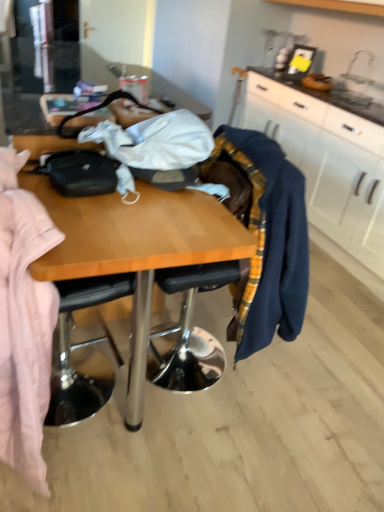
Question: In terms of size, does white matte cabinet at upper right appear bigger or smaller than navy blue sweater at right?

Choices:
 (A) big
 (B) small

Answer: (A)

Question: In the image, is white matte cabinet at upper right on the left side or the right side of navy blue sweater at right?

Choices:
 (A) right
 (B) left

Answer: (A)

Question: Which of these objects is positioned farthest from the white matte cabinet at upper right?

Choices:
 (A) metallic silver chair at center
 (B) navy blue sweater at right

Answer: (B)

Question: Estimate the real-world distances between objects in this image. Which object is closer to the navy blue sweater at right?

Choices:
 (A) metallic silver chair at center
 (B) white matte cabinet at upper right

Answer: (A)